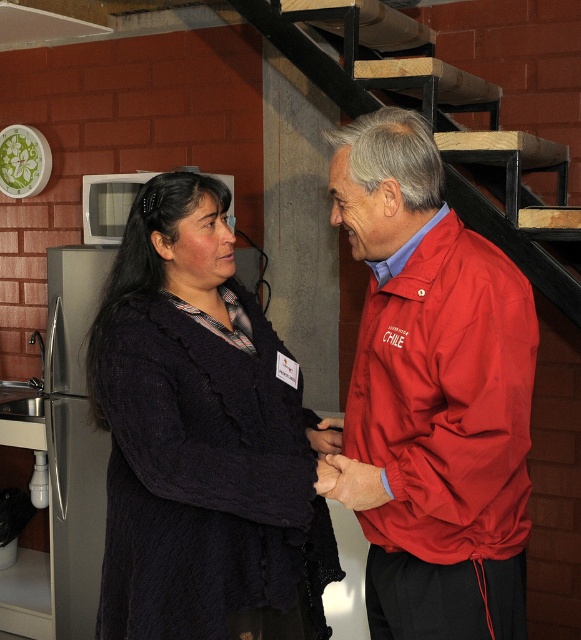
Question: Is dark blue knitted sweater at center to the left of wooden stairs at upper center from the viewer's perspective?

Choices:
 (A) no
 (B) yes

Answer: (B)

Question: Which point is farther to the camera?

Choices:
 (A) (238, 292)
 (B) (303, 70)

Answer: (B)

Question: Observing the image, what is the correct spatial positioning of dark blue knitted sweater at center in reference to red nylon jacket at center?

Choices:
 (A) right
 (B) left

Answer: (B)

Question: Which of the following is the closest to the observer?

Choices:
 (A) dark blue knitted sweater at center
 (B) wooden stairs at upper center
 (C) red nylon jacket at center

Answer: (C)

Question: Which point appears closest to the camera in this image?

Choices:
 (A) (206, 474)
 (B) (317, 76)

Answer: (A)

Question: Does dark blue knitted sweater at center lie in front of red nylon jacket at center?

Choices:
 (A) no
 (B) yes

Answer: (A)